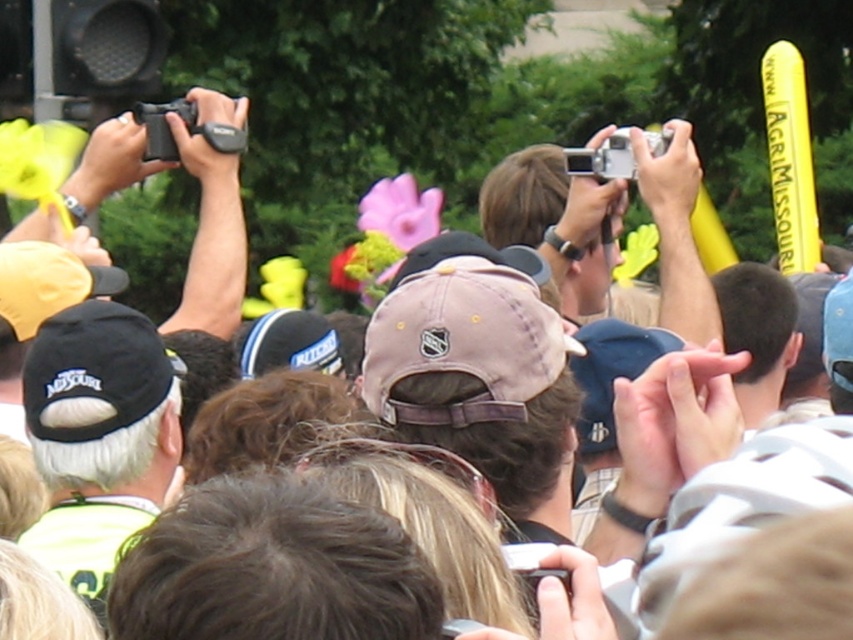
You are standing in the crowd and want to take a photo of the stage. There are two points in the scene labeled as point [370,332] and point [61,333]. Which point is closer to you?

Point [370,332] is closer to the camera than point [61,333].

Where is the light brown fabric baseball cap at center located in the image?

The light brown fabric baseball cap at center is located at point (479,380) in the image.

You are a photographer trying to capture a photo of the stage at an event. You notice two caps in your frame, the light brown fabric baseball cap at center and the black fabric cap at left. Which cap is smaller in your photo?

The light brown fabric baseball cap at center is smaller because it occupies less space than the black fabric cap at left in the photo.